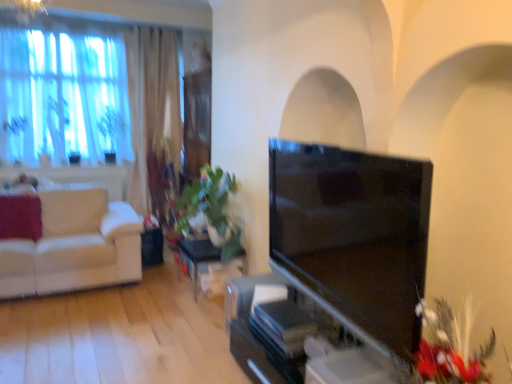
Question: Does matte black tv at center have a greater height compared to white fabric couch at left?

Choices:
 (A) no
 (B) yes

Answer: (B)

Question: Is matte black tv at center behind white fabric couch at left?

Choices:
 (A) no
 (B) yes

Answer: (A)

Question: Is there a large distance between matte black tv at center and white fabric couch at left?

Choices:
 (A) yes
 (B) no

Answer: (A)

Question: Is white fabric couch at left inside matte black tv at center?

Choices:
 (A) yes
 (B) no

Answer: (B)

Question: From a real-world perspective, is matte black tv at center physically above white fabric couch at left?

Choices:
 (A) yes
 (B) no

Answer: (A)

Question: Is green leafy plant at upper left in front of or behind green glossy table at center in the image?

Choices:
 (A) front
 (B) behind

Answer: (B)

Question: Based on their sizes in the image, would you say green leafy plant at upper left is bigger or smaller than green glossy table at center?

Choices:
 (A) big
 (B) small

Answer: (B)

Question: Considering the relative positions of green leafy plant at upper left and green glossy table at center in the image provided, is green leafy plant at upper left to the left or to the right of green glossy table at center?

Choices:
 (A) left
 (B) right

Answer: (A)

Question: From a real-world perspective, relative to green glossy table at center, is green leafy plant at upper left vertically above or below?

Choices:
 (A) below
 (B) above

Answer: (B)

Question: Is white fabric couch at left wider or thinner than fluffy red flowers at lower right?

Choices:
 (A) thin
 (B) wide

Answer: (B)

Question: Is white fabric couch at left to the left or to the right of fluffy red flowers at lower right in the image?

Choices:
 (A) right
 (B) left

Answer: (B)

Question: Considering the positions of point (78, 216) and point (446, 334), is point (78, 216) closer or farther from the camera than point (446, 334)?

Choices:
 (A) farther
 (B) closer

Answer: (A)

Question: From a real-world perspective, is white fabric couch at left physically located above or below fluffy red flowers at lower right?

Choices:
 (A) above
 (B) below

Answer: (B)

Question: Is fluffy red flowers at lower right spatially inside matte black tv at center, or outside of it?

Choices:
 (A) inside
 (B) outside

Answer: (B)

Question: Considering their positions, is fluffy red flowers at lower right located in front of or behind matte black tv at center?

Choices:
 (A) behind
 (B) front

Answer: (B)